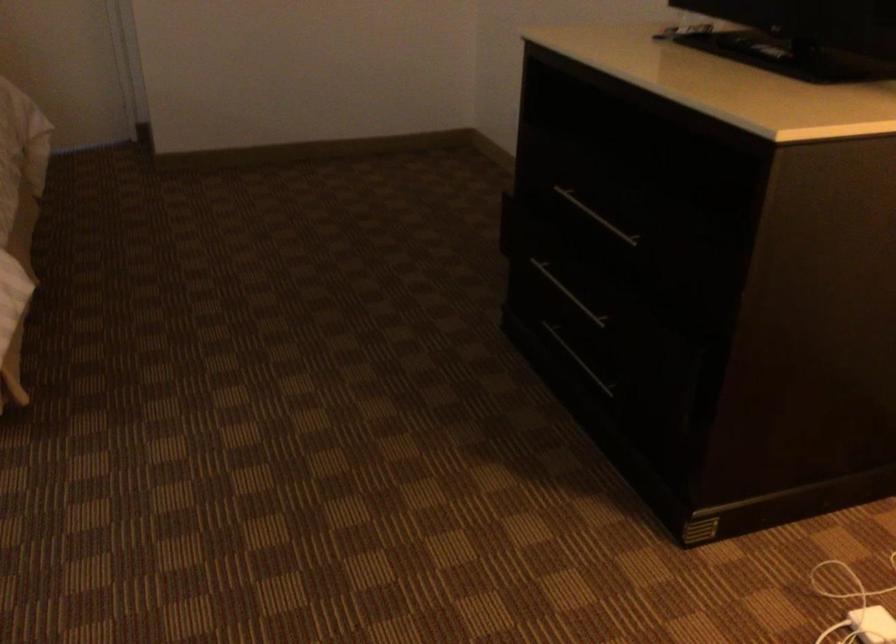
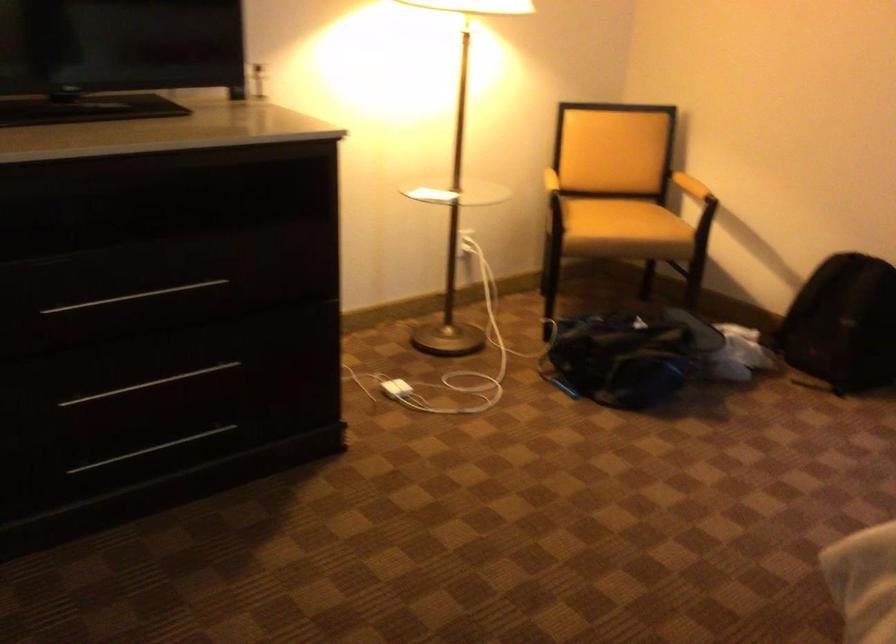
Locate, in the second image, the point that corresponds to point 604,220 in the first image.

(134, 297)